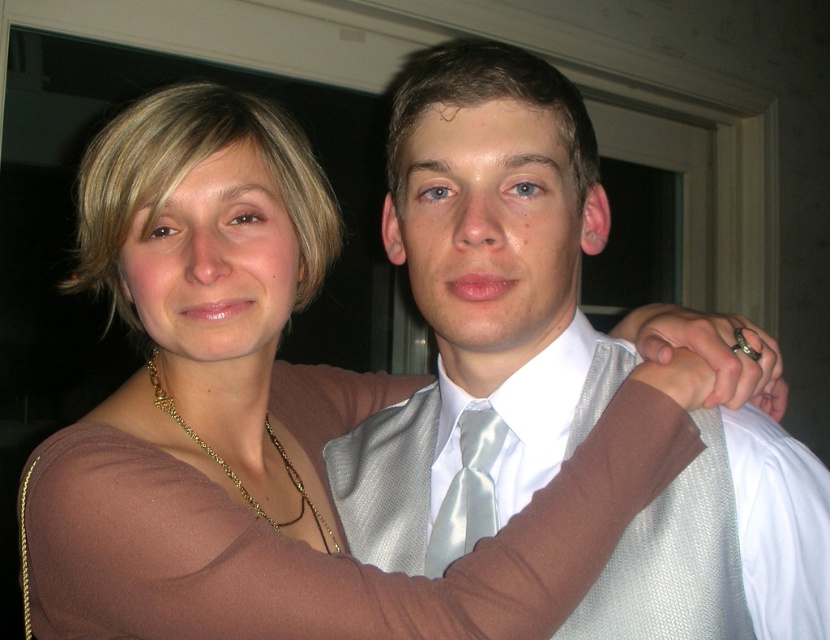
Question: Which of the following is the closest to the observer?

Choices:
 (A) (481, 406)
 (B) (160, 396)

Answer: (A)

Question: Considering the relative positions of satin light blue tie at center and gold chain necklace at center in the image provided, where is satin light blue tie at center located with respect to gold chain necklace at center?

Choices:
 (A) right
 (B) left

Answer: (A)

Question: Is satin light blue tie at center bigger than gold chain necklace at center?

Choices:
 (A) yes
 (B) no

Answer: (B)

Question: Which is nearer to the satin white vest at center?

Choices:
 (A) satin light blue tie at center
 (B) gold chain necklace at center

Answer: (A)

Question: Does satin light blue tie at center have a larger size compared to gold chain necklace at center?

Choices:
 (A) yes
 (B) no

Answer: (B)

Question: Which point is closer to the camera?

Choices:
 (A) click(x=470, y=513)
 (B) click(x=340, y=481)
 (C) click(x=169, y=416)

Answer: (A)